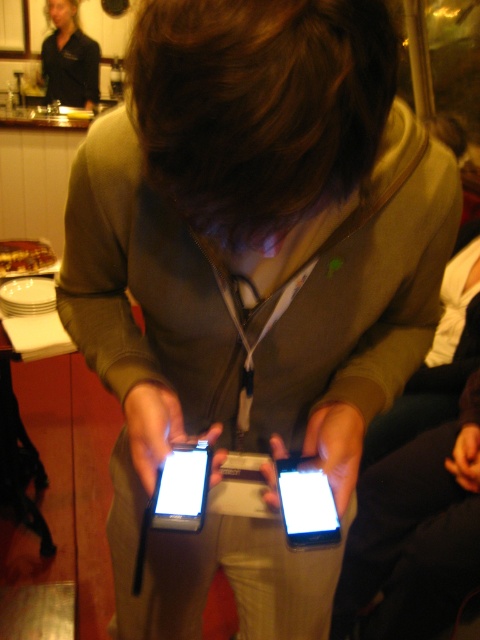
Question: Is matte black smartphone at center thinner than black glossy smartphone at center?

Choices:
 (A) no
 (B) yes

Answer: (B)

Question: Estimate the real-world distances between objects in this image. Which object is farther from the black glossy smartphone at center?

Choices:
 (A) matte black smartphone at center
 (B) black shirt at upper left

Answer: (B)

Question: Among these points, which one is farthest from the camera?

Choices:
 (A) (87, 51)
 (B) (200, 461)
 (C) (301, 496)

Answer: (A)

Question: Does matte black smartphone at center have a smaller size compared to black glossy smartphone at center?

Choices:
 (A) no
 (B) yes

Answer: (B)

Question: Which of the following is the closest to the observer?

Choices:
 (A) black glossy smartphone at center
 (B) black shirt at upper left
 (C) matte black smartphone at center

Answer: (C)

Question: Does black shirt at upper left have a greater width compared to black glossy smartphone at center?

Choices:
 (A) yes
 (B) no

Answer: (A)